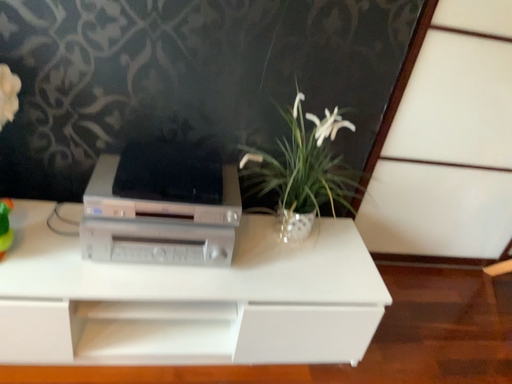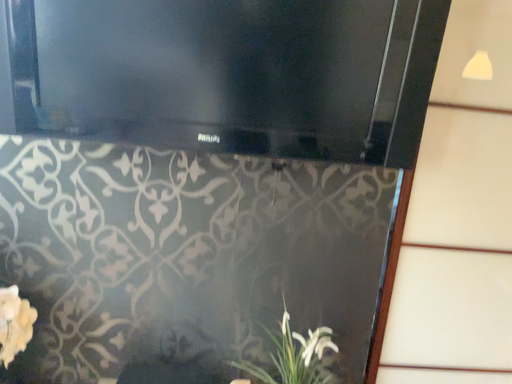
Question: Which way did the camera rotate in the video?

Choices:
 (A) rotated downward
 (B) rotated upward

Answer: (B)